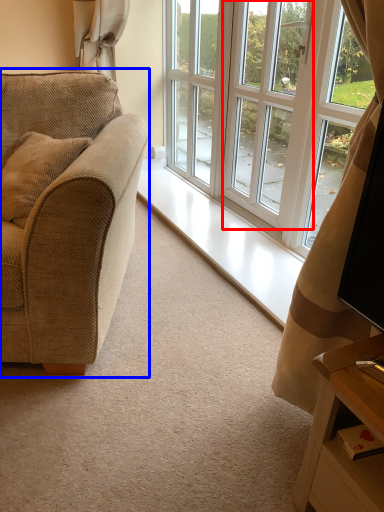
Question: Which of the following is the farthest to the observer, screen door (highlighted by a red box) or studio couch (highlighted by a blue box)?

Choices:
 (A) screen door
 (B) studio couch

Answer: (A)